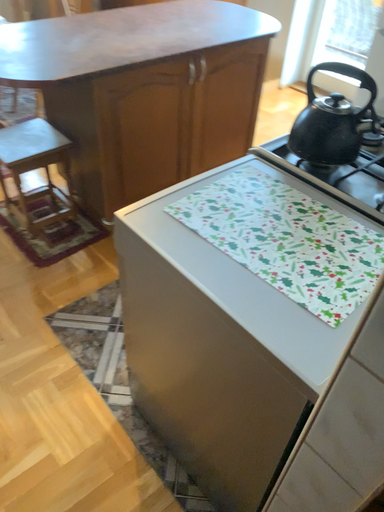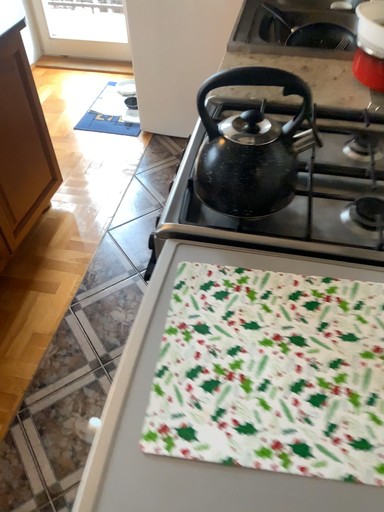
Question: How did the camera likely rotate when shooting the video?

Choices:
 (A) rotated left
 (B) rotated right

Answer: (B)